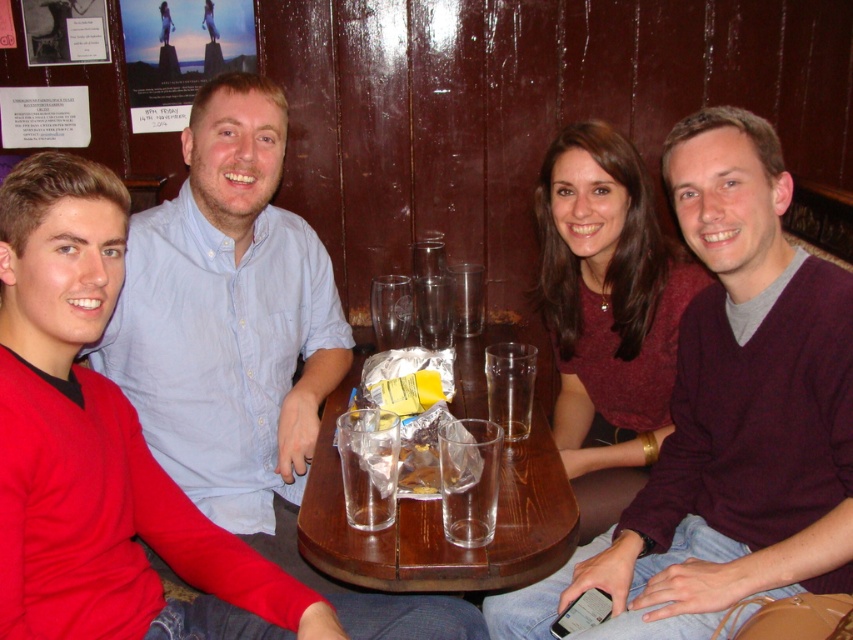
Question: Which point is farther to the camera?

Choices:
 (A) blue button-down shirt at left
 (B) maroon sweater at center

Answer: (A)

Question: Which of the following is the farthest from the observer?

Choices:
 (A) (550, 518)
 (B) (636, 580)

Answer: (B)

Question: Considering the relative positions of blue button-down shirt at left and transparent glass table at center in the image provided, where is blue button-down shirt at left located with respect to transparent glass table at center?

Choices:
 (A) right
 (B) left

Answer: (B)

Question: Which of these objects is positioned closest to the maroon sweater at center?

Choices:
 (A) transparent glass table at center
 (B) blue button-down shirt at left

Answer: (A)

Question: Does maroon sweater at center appear over transparent glass table at center?

Choices:
 (A) no
 (B) yes

Answer: (B)

Question: Does maroon sweater at center have a greater width compared to blue button-down shirt at left?

Choices:
 (A) no
 (B) yes

Answer: (B)